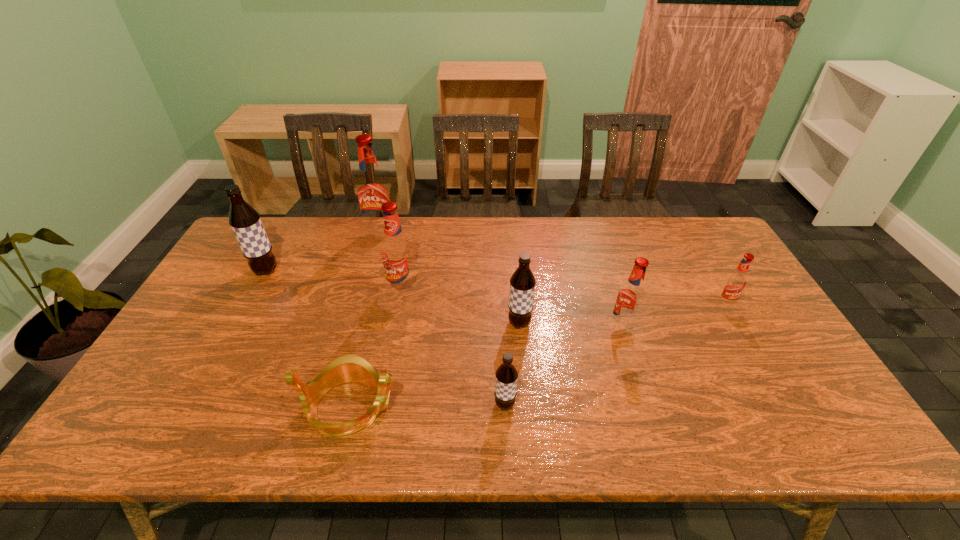
You are a GUI agent. You are given a task and a screenshot of the screen. Output one action in this format:
    pyautogui.click(x=<x>, y=<y>)
    Task: Click on the free space located 0.140m on the front of the smallest red root beer
    
    Given the screenshot: What is the action you would take?
    pyautogui.click(x=751, y=348)

Locate an element on the screen. vacant space located on the right of the nearest root beer is located at coordinates (660, 404).

The width and height of the screenshot is (960, 540). Find the location of `vacant area located 0.400m at the front emblem of the shortest object`. vacant area located 0.400m at the front emblem of the shortest object is located at coordinates (570, 407).

Locate an element on the screen. This screenshot has height=540, width=960. object located at the far edge is located at coordinates (372, 189).

Where is `root beer present at the near edge`? The height and width of the screenshot is (540, 960). root beer present at the near edge is located at coordinates (506, 374).

Where is `tiara at the near edge`? tiara at the near edge is located at coordinates (350, 368).

Locate an element on the screen. This screenshot has height=540, width=960. object at the left edge is located at coordinates (245, 221).

The height and width of the screenshot is (540, 960). Find the location of `object that is at the right edge`. object that is at the right edge is located at coordinates (735, 283).

At what (x,y) coordinates should I click in order to perform the action: click on vacant region at the far edge of the desktop. Please return your answer as a coordinate pair (x, y). Looking at the image, I should click on (328, 219).

The height and width of the screenshot is (540, 960). In order to click on free space at the near edge of the desktop in this screenshot , I will do `click(574, 428)`.